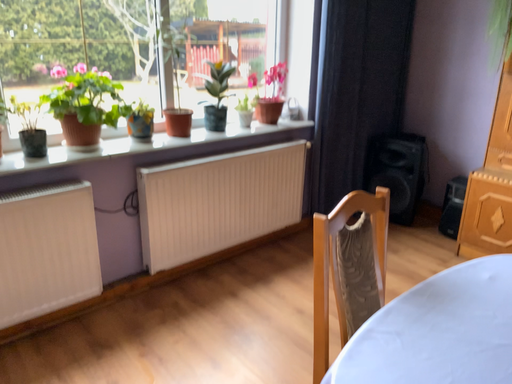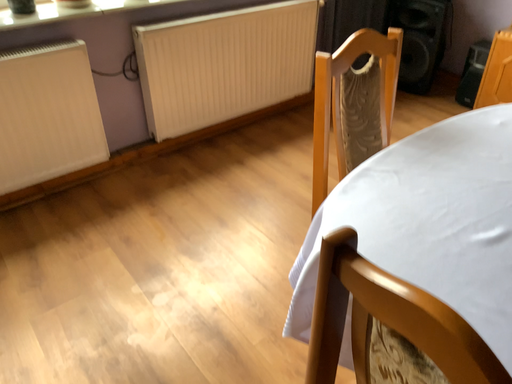
Question: Which way did the camera rotate in the video?

Choices:
 (A) rotated upward
 (B) rotated downward

Answer: (B)